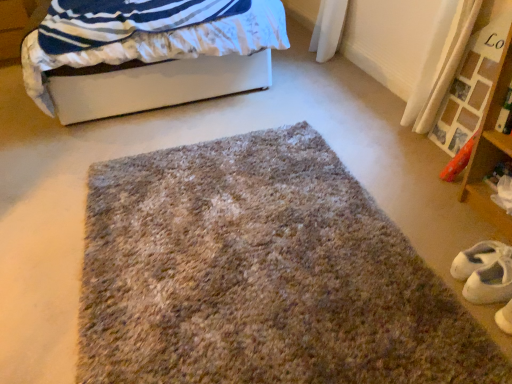
Locate an element on the screen. This screenshot has width=512, height=384. vacant area in front of white suede shoe at lower right is located at coordinates (487, 332).